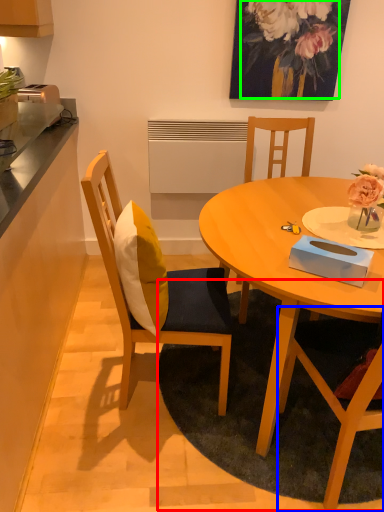
Question: Which is farther away from mat (highlighted by a red box)? chair (highlighted by a blue box) or floral arrangement (highlighted by a green box)?

Choices:
 (A) chair
 (B) floral arrangement

Answer: (B)